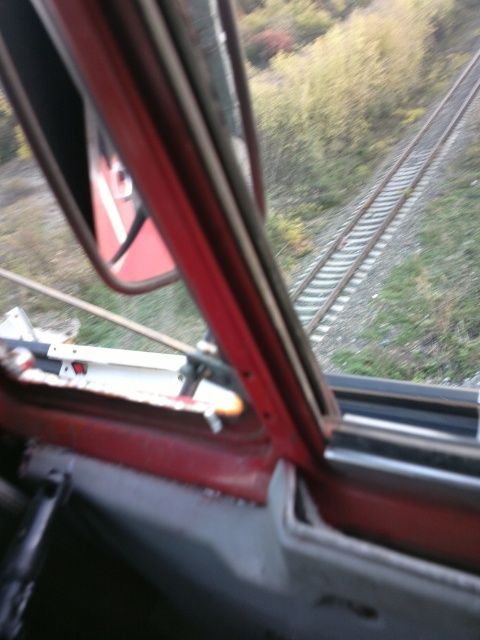
Consider the image. You are sitting inside the train and looking through the partially open window. There are two points marked on the window glass at coordinates point [206,35] and point [382,221]. Which point is closer to your eyes?

Point [206,35] is closer to the viewer than point [382,221].